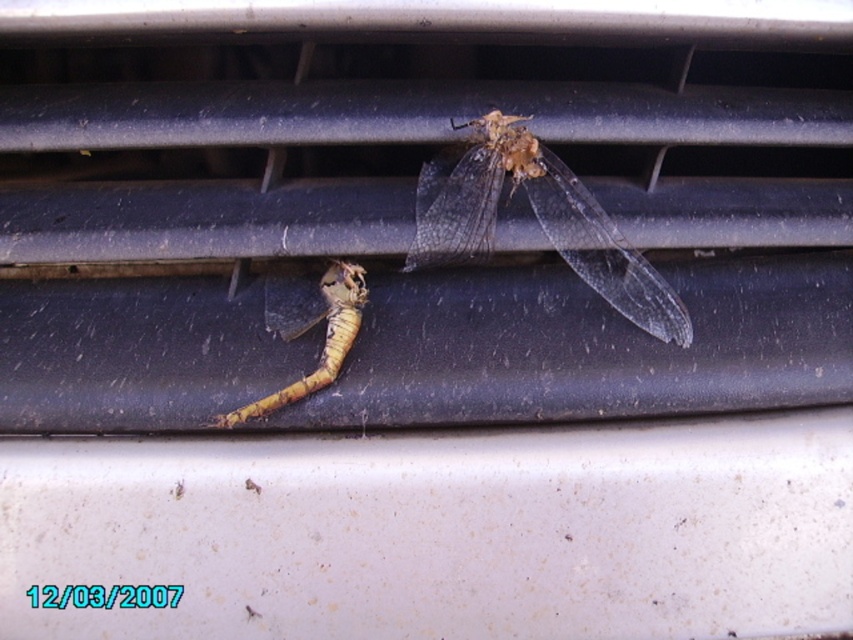
Question: Does translucent winged insect at upper center appear under yellowish-brown exoskeleton at center?

Choices:
 (A) no
 (B) yes

Answer: (A)

Question: Is translucent winged insect at upper center further to camera compared to yellowish-brown exoskeleton at center?

Choices:
 (A) no
 (B) yes

Answer: (B)

Question: Is translucent winged insect at upper center thinner than yellowish-brown exoskeleton at center?

Choices:
 (A) no
 (B) yes

Answer: (A)

Question: Which point is farther from the camera taking this photo?

Choices:
 (A) (299, 394)
 (B) (628, 250)

Answer: (B)

Question: Among these points, which one is nearest to the camera?

Choices:
 (A) [x=236, y=416]
 (B) [x=547, y=218]

Answer: (A)